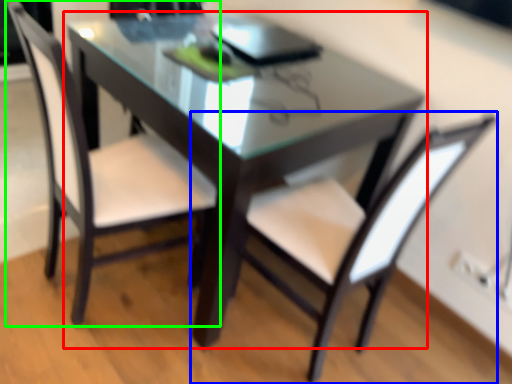
Question: Which is nearer to the table (highlighted by a red box)? chair (highlighted by a blue box) or chair (highlighted by a green box).

Choices:
 (A) chair
 (B) chair

Answer: (B)